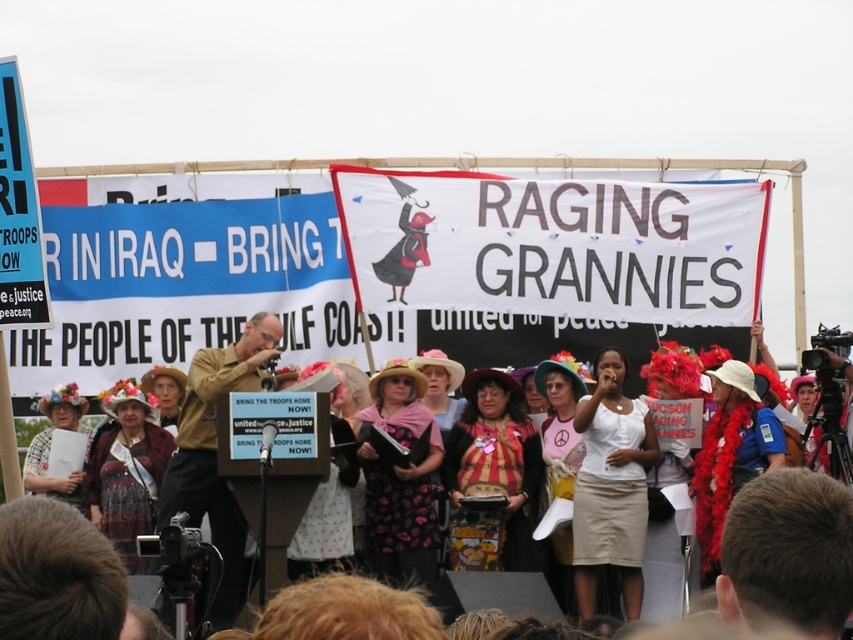
Can you confirm if white fabric skirt at center is taller than matte brown hat at center?

Correct, white fabric skirt at center is much taller as matte brown hat at center.

Is point (637, 428) behind point (171, 378)?

No.

The image size is (853, 640). Describe the element at coordinates (611, 486) in the screenshot. I see `white fabric skirt at center` at that location.

Find the location of `white fabric skirt at center`. white fabric skirt at center is located at coordinates (611, 486).

Does striped fabric dress at center have a larger size compared to pink fabric shirt at center?

Indeed, striped fabric dress at center has a larger size compared to pink fabric shirt at center.

Consider the image. Who is more distant from viewer, (497, 544) or (556, 474)?

Positioned behind is point (556, 474).

The height and width of the screenshot is (640, 853). I want to click on striped fabric dress at center, so click(490, 472).

I want to click on striped fabric dress at center, so click(490, 472).

Who is more distant from viewer, (402, 577) or (55, 412)?

The point (55, 412) is more distant.

Does floral fabric dress at center have a greater height compared to floral fabric dress at lower left?

Correct, floral fabric dress at center is much taller as floral fabric dress at lower left.

The image size is (853, 640). What do you see at coordinates (399, 477) in the screenshot? I see `floral fabric dress at center` at bounding box center [399, 477].

This screenshot has width=853, height=640. Identify the location of floral fabric dress at center. (399, 477).